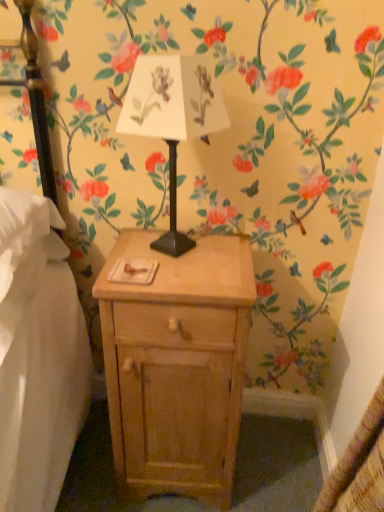
Image resolution: width=384 pixels, height=512 pixels. I want to click on vacant area that lies to the right of light wood nightstand at center, so click(272, 464).